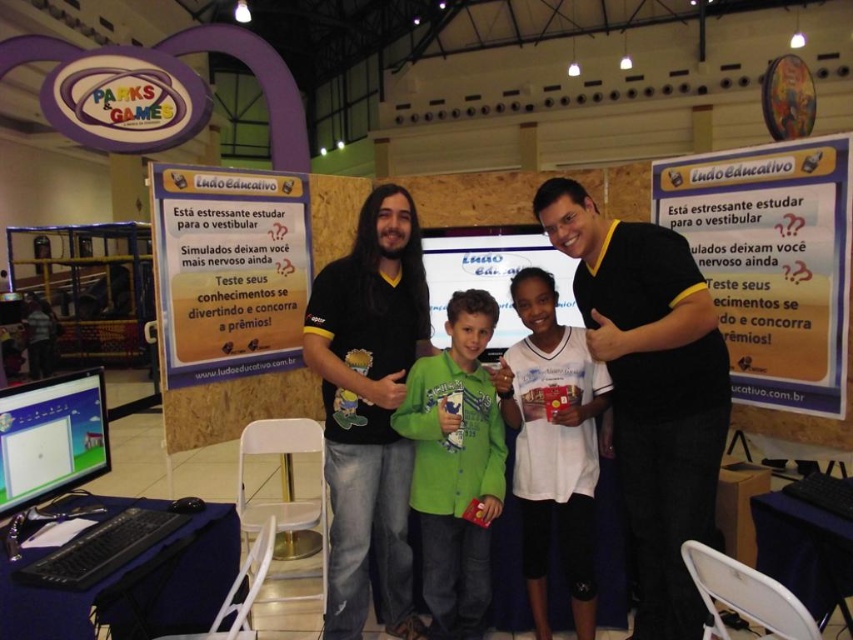
Based on the photo, can you confirm if white cotton shirt at center is positioned to the left of matte plastic computer screen at lower left?

No, white cotton shirt at center is not to the left of matte plastic computer screen at lower left.

Does white cotton shirt at center come in front of matte plastic computer screen at lower left?

No, white cotton shirt at center is further to the viewer.

Between point (599, 371) and point (7, 387), which one is positioned in front?

Point (7, 387) is more forward.

Where is `white cotton shirt at center`? white cotton shirt at center is located at coordinates (553, 445).

Is point (631, 392) behind point (576, 429)?

That is False.

Between black/yellow t-shirt at center and white cotton shirt at center, which one appears on the right side from the viewer's perspective?

black/yellow t-shirt at center is more to the right.

Is point (567, 189) closer to viewer compared to point (589, 461)?

Yes, point (567, 189) is in front of point (589, 461).

Where is `black/yellow t-shirt at center`? black/yellow t-shirt at center is located at coordinates (650, 390).

Which of these two, black matte shirt at center or green matte shirt at center, stands shorter?

Standing shorter between the two is green matte shirt at center.

Is point (384, 189) positioned in front of point (428, 432)?

No, it is behind (428, 432).

Which is in front, point (405, 544) or point (426, 493)?

Point (426, 493) is more forward.

Locate an element on the screen. black matte shirt at center is located at coordinates (369, 408).